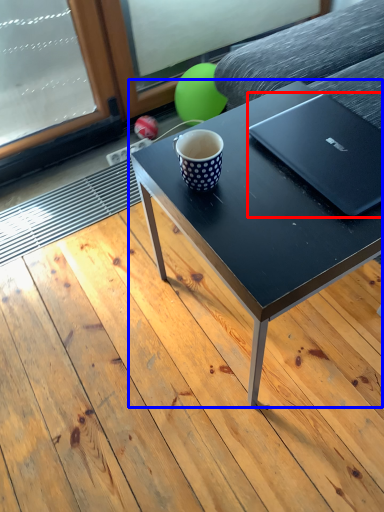
Question: Which object is further to the camera taking this photo, laptop (highlighted by a red box) or coffee table (highlighted by a blue box)?

Choices:
 (A) laptop
 (B) coffee table

Answer: (A)